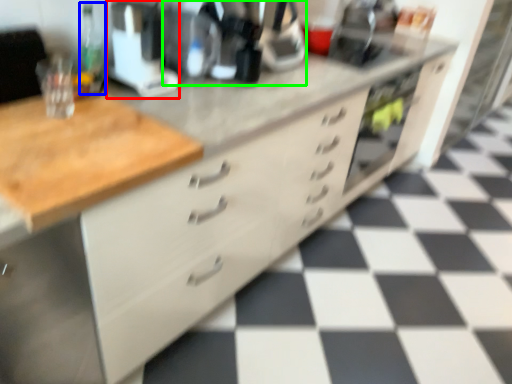
Question: Which is nearer to the appliance (highlighted by a red box)? bottle (highlighted by a blue box) or coffee machine (highlighted by a green box).

Choices:
 (A) bottle
 (B) coffee machine

Answer: (A)